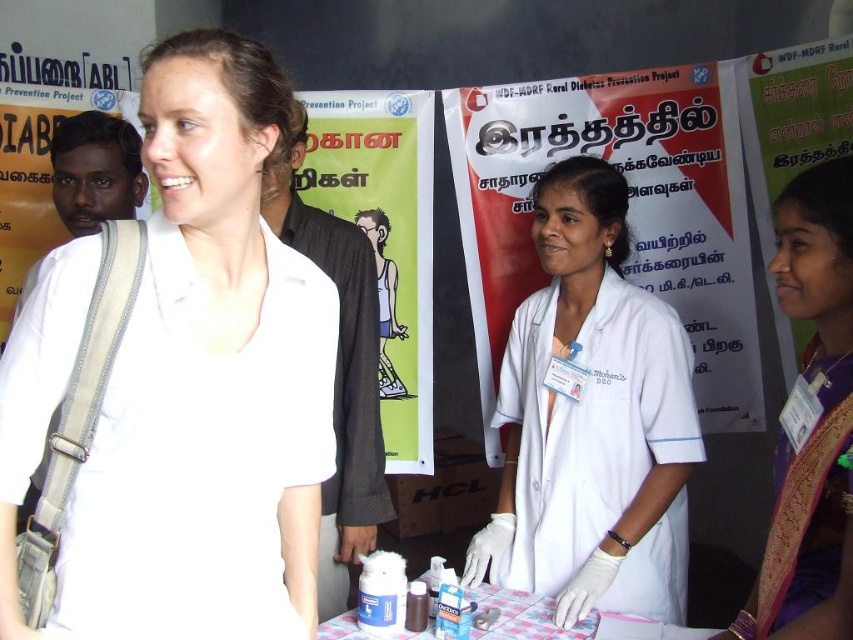
Question: Can you confirm if white matte shirt at upper left is thinner than purple silk saree at right?

Choices:
 (A) no
 (B) yes

Answer: (A)

Question: Can you confirm if purple silk saree at right is positioned to the left of brown matte bottle at center?

Choices:
 (A) no
 (B) yes

Answer: (A)

Question: Which point is closer to the camera?

Choices:
 (A) plastic/transparent container at center
 (B) white plastic bottle at center
 (C) white matte shirt at upper left
 (D) purple silk saree at right

Answer: (C)

Question: Does white matte shirt at upper left appear under white plastic bottle at center?

Choices:
 (A) yes
 (B) no

Answer: (B)

Question: Based on their relative distances, which object is farther from the white lab coat at center?

Choices:
 (A) white plastic bottle at center
 (B) brown matte bottle at center
 (C) white matte shirt at upper left
 (D) purple silk saree at right

Answer: (C)

Question: Among these points, which one is farthest from the camera?

Choices:
 (A) (419, 625)
 (B) (498, 589)
 (C) (379, 632)
 (D) (785, 269)

Answer: (B)